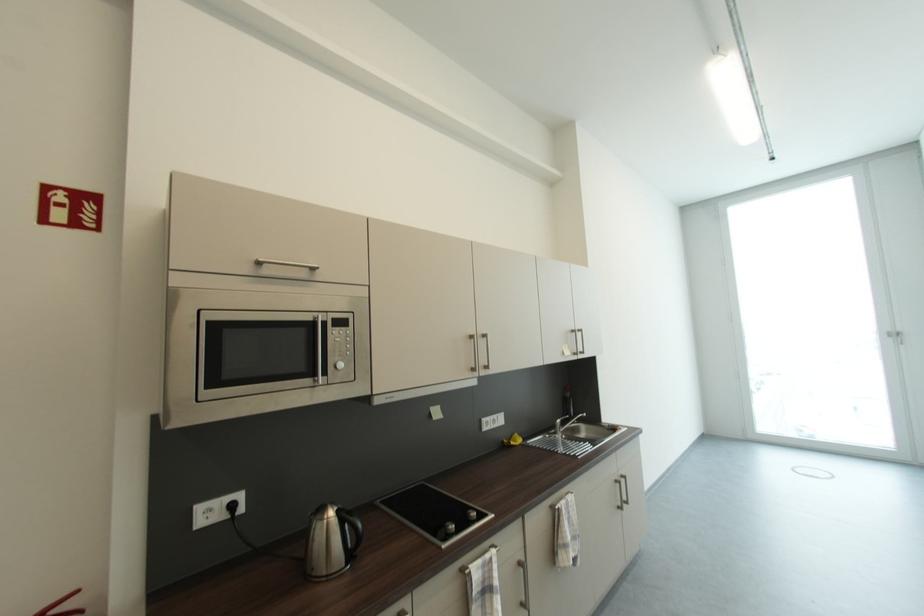
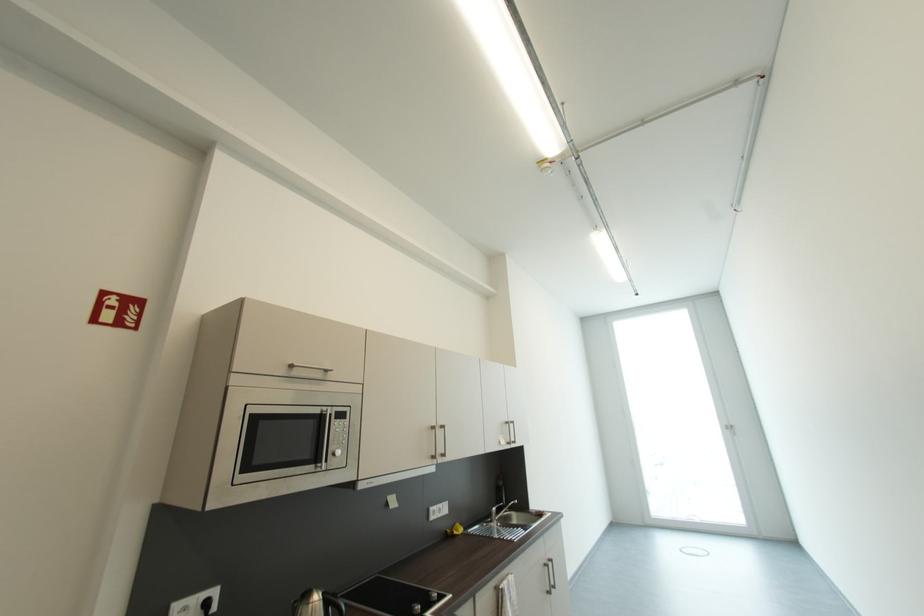
In the second image, find the point that corresponds to the point at 265,264 in the first image.

(298, 368)